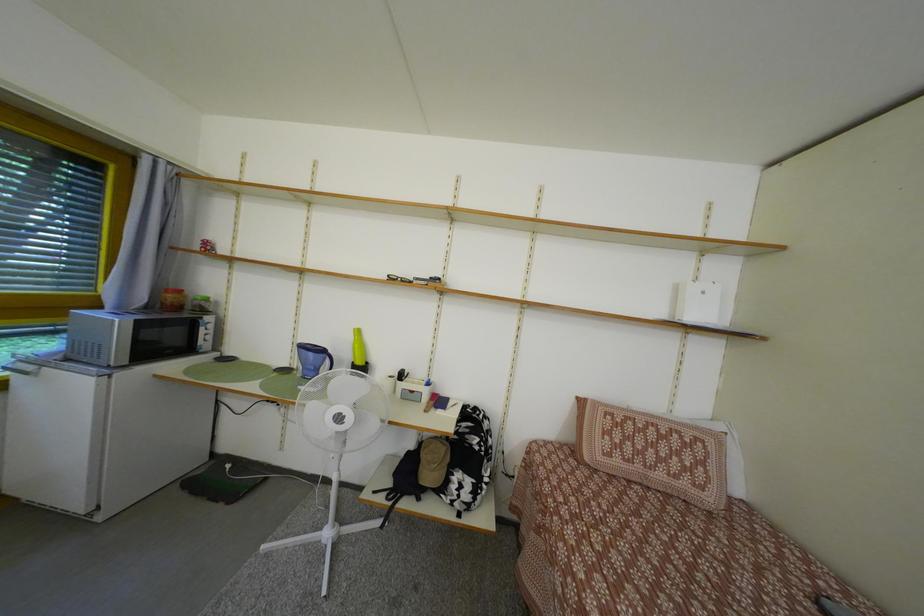
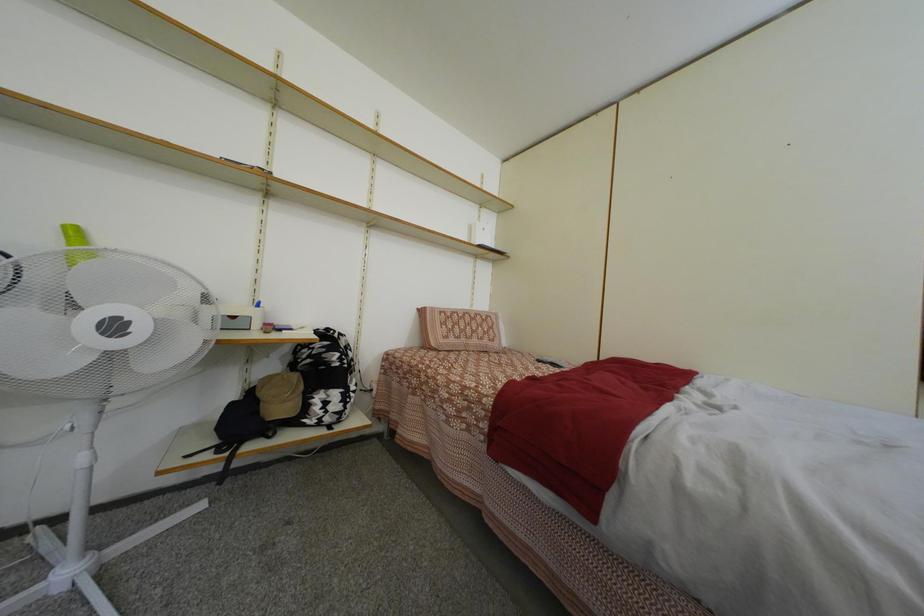
Question: Based on the continuous images, in which direction is the camera rotating? Reply with the corresponding letter.

Choices:
 (A) Left
 (B) Right
 (C) Up
 (D) Down

Answer: (B)